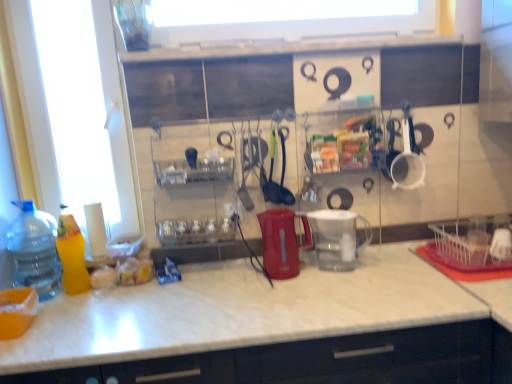
Question: Could you tell me if green plastic ladle at center, which is the first tableware in left-to-right order, is turned towards white plastic cup at upper right, the first tableware in the right-to-left sequence?

Choices:
 (A) yes
 (B) no

Answer: (B)

Question: Does green plastic ladle at center, positioned as the 3th tableware in right-to-left order, appear on the right side of white plastic cup at upper right, the first tableware in the right-to-left sequence?

Choices:
 (A) yes
 (B) no

Answer: (B)

Question: Is green plastic ladle at center, which is the first tableware in left-to-right order, wider than white plastic cup at upper right, the first tableware in the right-to-left sequence?

Choices:
 (A) yes
 (B) no

Answer: (A)

Question: Is green plastic ladle at center, which is the first tableware in left-to-right order, located outside white plastic cup at upper right, the first tableware in the right-to-left sequence?

Choices:
 (A) no
 (B) yes

Answer: (B)

Question: Is green plastic ladle at center, which is the first tableware in left-to-right order, placed right next to white plastic cup at upper right, the first tableware in the right-to-left sequence?

Choices:
 (A) no
 (B) yes

Answer: (A)

Question: From a real-world perspective, is black rubber spatula at center, the second tableware positioned from the right, above or below white plastic cup at upper right, the first tableware in the right-to-left sequence?

Choices:
 (A) above
 (B) below

Answer: (A)

Question: From the image's perspective, is black rubber spatula at center, the second tableware positioned from the right, above or below white plastic cup at upper right, the first tableware in the right-to-left sequence?

Choices:
 (A) above
 (B) below

Answer: (B)

Question: Is black rubber spatula at center, the second tableware positioned from the right, taller or shorter than white plastic cup at upper right, arranged as the 3th tableware when viewed from the left?

Choices:
 (A) short
 (B) tall

Answer: (B)

Question: Is black rubber spatula at center, the second tableware positioned from the right, to the left or to the right of white plastic cup at upper right, the first tableware in the right-to-left sequence, in the image?

Choices:
 (A) right
 (B) left

Answer: (B)

Question: Do you think transparent plastic bottle at left, which appears as the 1th bottle when viewed from the left, is within white marble countertop at center, or outside of it?

Choices:
 (A) outside
 (B) inside

Answer: (A)

Question: Does point (47, 274) appear closer or farther from the camera than point (198, 377)?

Choices:
 (A) farther
 (B) closer

Answer: (A)

Question: Is transparent plastic bottle at left, which appears as the 1th bottle when viewed from the left, in front of or behind white marble countertop at center in the image?

Choices:
 (A) behind
 (B) front

Answer: (A)

Question: From a real-world perspective, is transparent plastic bottle at left, marked as the second bottle in a right-to-left arrangement, physically located above or below white marble countertop at center?

Choices:
 (A) above
 (B) below

Answer: (A)

Question: From the image's perspective, is matte plastic kettle at center, which ranks as the 1th appliance in left-to-right order, located above or below transparent plastic bottle at left, marked as the second bottle in a right-to-left arrangement?

Choices:
 (A) above
 (B) below

Answer: (A)

Question: Considering the relative positions of matte plastic kettle at center, which ranks as the 1th appliance in left-to-right order, and transparent plastic bottle at left, marked as the second bottle in a right-to-left arrangement, in the image provided, is matte plastic kettle at center, which ranks as the 1th appliance in left-to-right order, to the left or to the right of transparent plastic bottle at left, marked as the second bottle in a right-to-left arrangement,?

Choices:
 (A) left
 (B) right

Answer: (B)